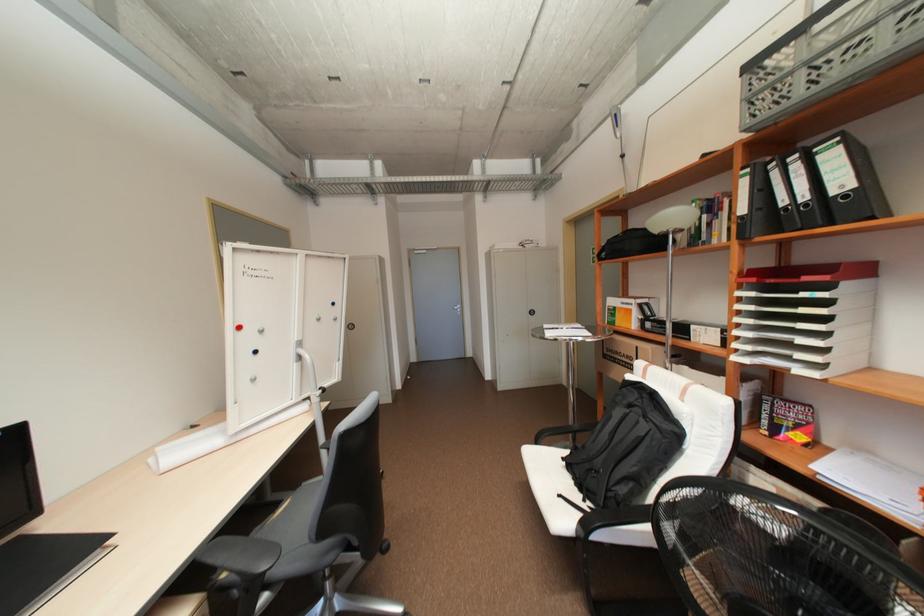
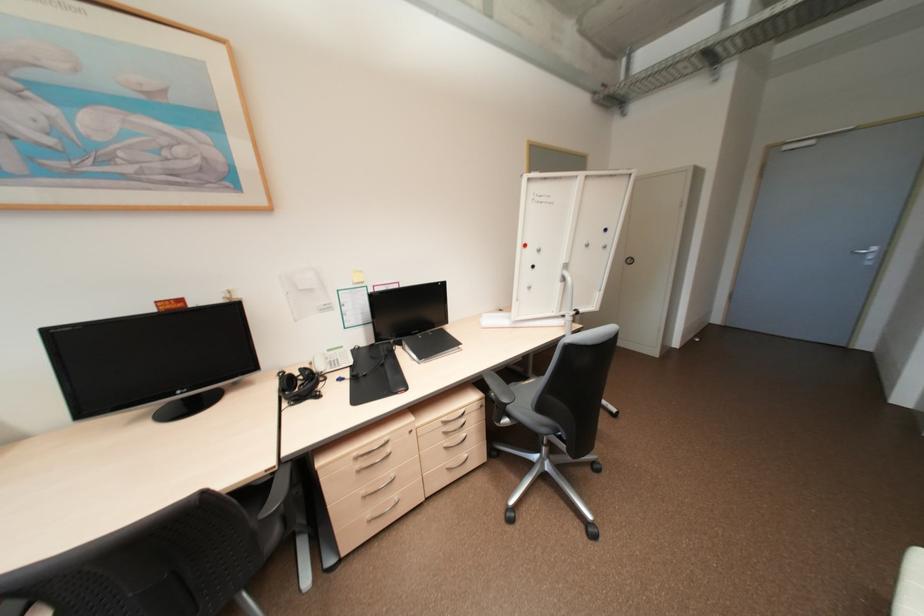
In the second image, find the point that corresponds to (x=270, y=567) in the first image.

(511, 400)